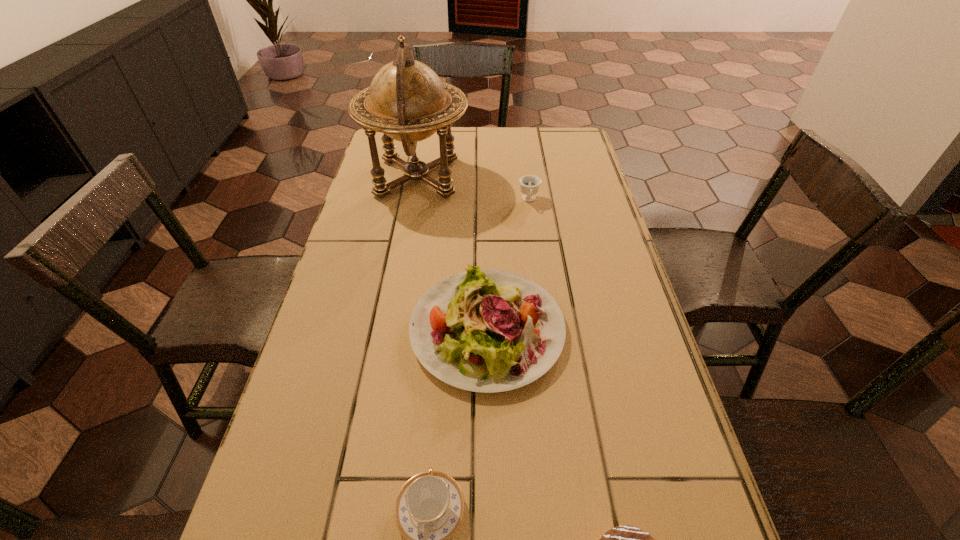
You are a GUI agent. You are given a task and a screenshot of the screen. Output one action in this format:
    pyautogui.click(x=<x>, y=<y>)
    Task: Click on the globe
    Image resolution: width=960 pixels, height=540 pixels.
    Given the screenshot: What is the action you would take?
    pyautogui.click(x=407, y=101)

What are the coordinates of `salad plate` in the screenshot? It's located at (486, 330).

At what (x,y) coordinates should I click in order to perform the action: click on the third nearest object. Please return your answer as a coordinate pair (x, y). Looking at the image, I should click on (486, 330).

Find the location of `the right teacup`. the right teacup is located at coordinates (529, 184).

You are a GUI agent. You are given a task and a screenshot of the screen. Output one action in this format:
    pyautogui.click(x=<x>, y=<y>)
    Task: Click on the vacant space located 0.320m on the front-facing side of the globe
    Image resolution: width=960 pixels, height=540 pixels.
    Given the screenshot: What is the action you would take?
    pyautogui.click(x=566, y=177)

Identify the location of free space located on the front of the fourth shortest object. The width and height of the screenshot is (960, 540). (490, 518).

The height and width of the screenshot is (540, 960). I want to click on free space located 0.170m on the side of the farther teacup with the handle, so click(535, 246).

Identify the location of object positioned at the far edge. Image resolution: width=960 pixels, height=540 pixels. (407, 101).

The image size is (960, 540). What are the coordinates of `object present at the left edge` in the screenshot? It's located at (407, 101).

Find the location of a particular element. Image resolution: width=960 pixels, height=540 pixels. object that is at the far left corner is located at coordinates [407, 101].